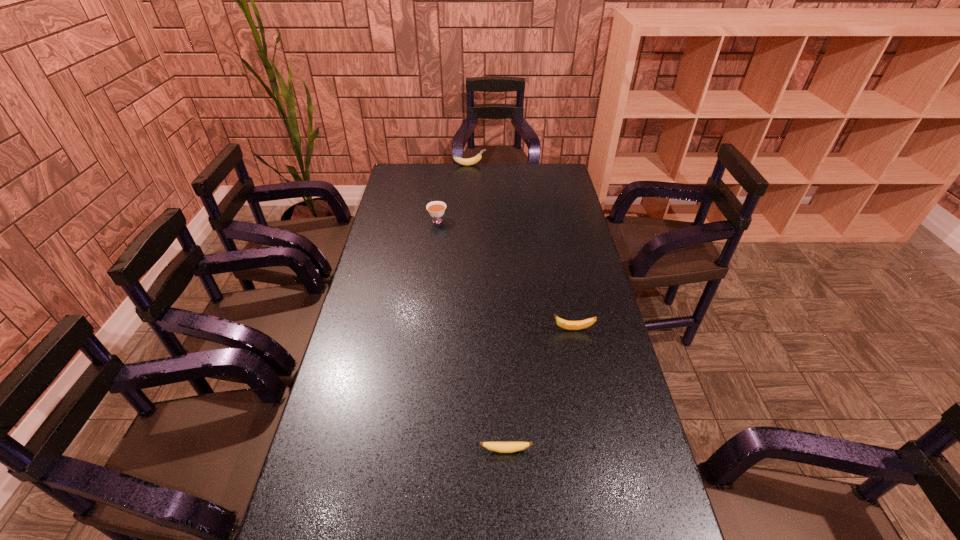
Locate an element on the screen. Image resolution: width=960 pixels, height=540 pixels. vacant space located at the stem of the rightmost object is located at coordinates (438, 329).

Identify the location of vacant space located 0.190m at the stem of the rightmost object. (492, 329).

Locate an element on the screen. vacant space located 0.270m at the stem of the rightmost object is located at coordinates (467, 329).

Identify the location of blank space located on the left of the nearest banana. (416, 450).

Find the location of a particular element. object located in the far edge section of the desktop is located at coordinates (470, 161).

Locate an element on the screen. The width and height of the screenshot is (960, 540). object that is at the right edge is located at coordinates (568, 325).

The height and width of the screenshot is (540, 960). I want to click on free spot at the far edge of the desktop, so click(482, 170).

The image size is (960, 540). In the image, there is a desktop. In order to click on vacant region at the left edge in this screenshot , I will do `click(330, 388)`.

Locate an element on the screen. This screenshot has height=540, width=960. free space at the right edge of the desktop is located at coordinates (626, 481).

Identify the location of free space at the far left corner of the desktop. Image resolution: width=960 pixels, height=540 pixels. (420, 176).